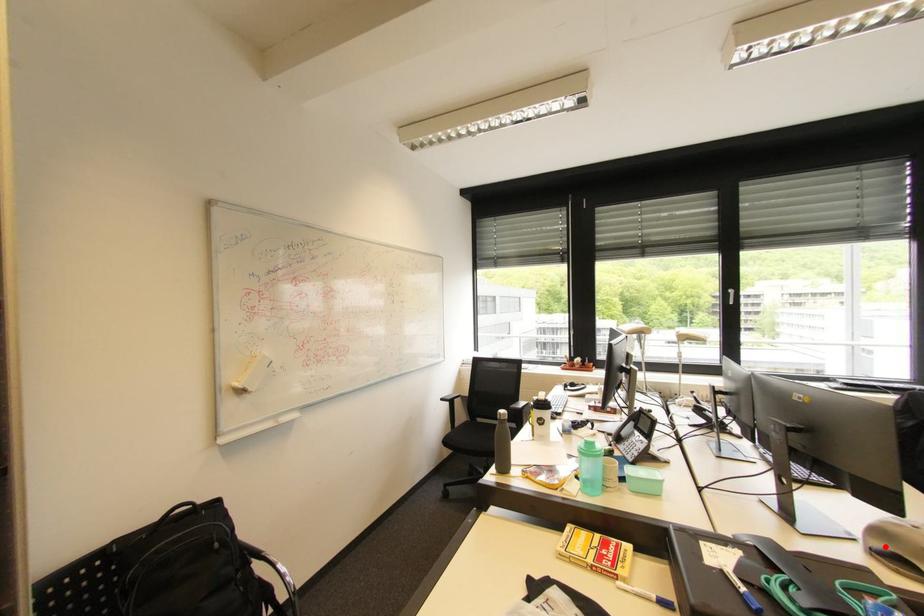
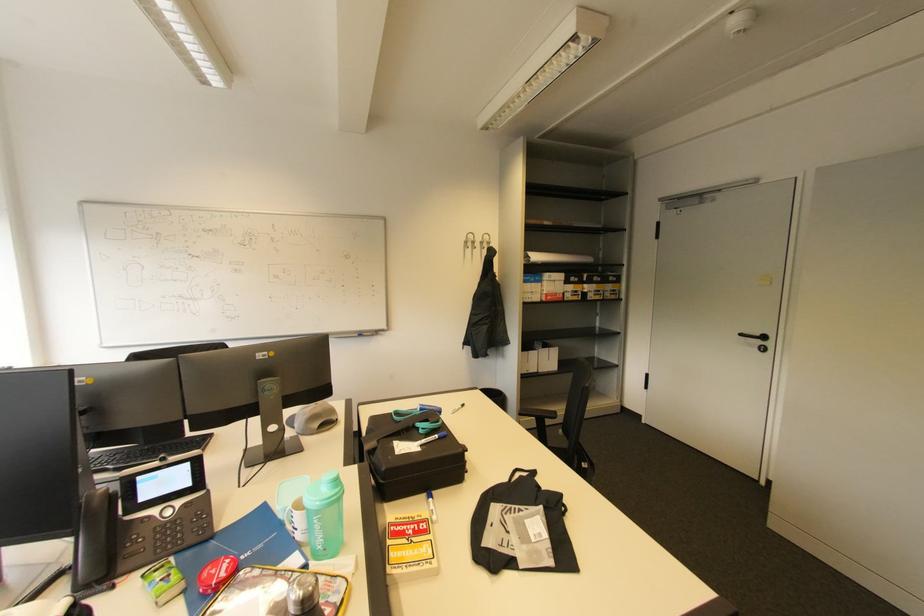
Question: A red point is marked in image1. In image2, is the corresponding 3D point closer to the camera or farther? Reply with the corresponding letter.

Choices:
 (A) The corresponding 3D point is closer.
 (B) The corresponding 3D point is farther.

Answer: (B)